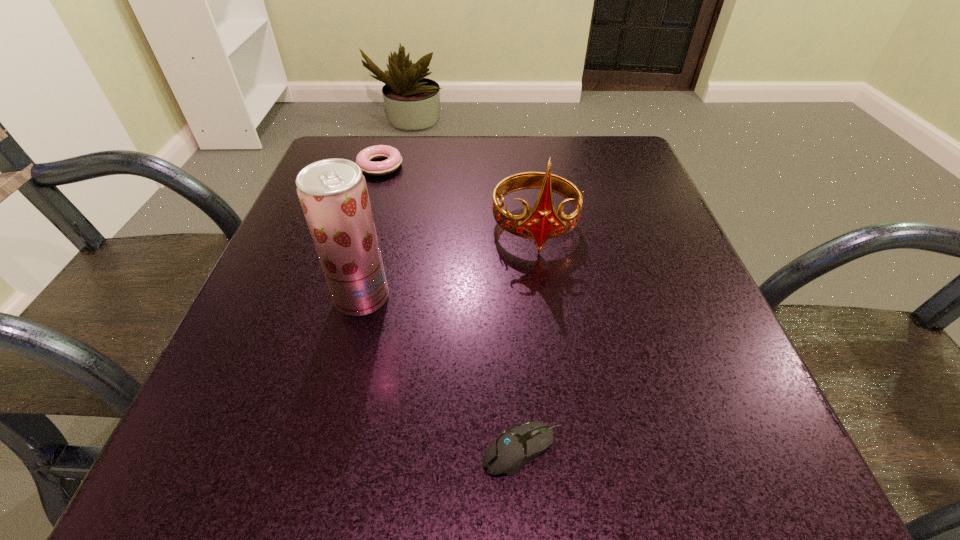
What are the coordinates of `fruit juice` in the screenshot? It's located at (333, 193).

Locate an element on the screen. This screenshot has height=540, width=960. the tallest object is located at coordinates (333, 193).

The width and height of the screenshot is (960, 540). What are the coordinates of `the second farthest object` in the screenshot? It's located at (542, 223).

At what (x,y) coordinates should I click in order to perform the action: click on tiara. Please return your answer as a coordinate pair (x, y). Image resolution: width=960 pixels, height=540 pixels. Looking at the image, I should click on (542, 223).

I want to click on doughnut, so click(364, 159).

This screenshot has width=960, height=540. In order to click on computer mouse in this screenshot , I will do `click(515, 447)`.

Where is `vacant region located 0.290m on the back of the fruit juice`? vacant region located 0.290m on the back of the fruit juice is located at coordinates point(391,184).

This screenshot has height=540, width=960. I want to click on vacant space located 0.120m on the front-facing side of the third nearest object, so click(547, 312).

The image size is (960, 540). Find the location of `vacant point located 0.370m on the front of the doughnut`. vacant point located 0.370m on the front of the doughnut is located at coordinates (339, 305).

The width and height of the screenshot is (960, 540). Find the location of `free space located 0.250m on the right of the nearest object`. free space located 0.250m on the right of the nearest object is located at coordinates (767, 450).